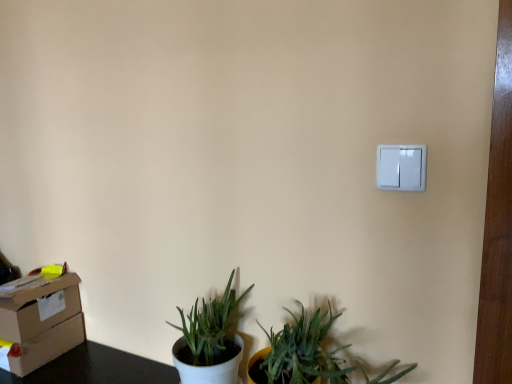
I want to click on white matte pot at lower left, so (210, 340).

Based on their sizes in the image, would you say matte brown cardboard box at lower left is bigger or smaller than white plastic light switch at upper right?

In the image, matte brown cardboard box at lower left appears to be larger than white plastic light switch at upper right.

Image resolution: width=512 pixels, height=384 pixels. I want to click on cardboard box beneath the white plastic light switch at upper right (from a real-world perspective), so click(39, 319).

How different are the orientations of matte brown cardboard box at lower left and white plastic light switch at upper right in degrees?

matte brown cardboard box at lower left and white plastic light switch at upper right are facing 4.34 degrees away from each other.

Is matte brown cardboard box at lower left aimed at white plastic light switch at upper right?

No.

Consider the image. Is white plastic light switch at upper right aimed at matte brown cardboard box at lower left?

No, white plastic light switch at upper right is not aimed at matte brown cardboard box at lower left.

Which object is more forward, white plastic light switch at upper right or matte brown cardboard box at lower left?

white plastic light switch at upper right is in front.

Considering the relative positions of white plastic light switch at upper right and matte brown cardboard box at lower left in the image provided, is white plastic light switch at upper right to the left or to the right of matte brown cardboard box at lower left?

Based on their positions, white plastic light switch at upper right is located to the right of matte brown cardboard box at lower left.

The image size is (512, 384). What are the coordinates of `light switch on the right of matte brown cardboard box at lower left` in the screenshot? It's located at (401, 167).

From the image's perspective, between white matte pot at lower left and white plastic light switch at upper right, who is located below?

white matte pot at lower left.

Identify the location of houseplant lying behind the white plastic light switch at upper right. This screenshot has width=512, height=384. (210, 340).

Would you consider white matte pot at lower left to be distant from white plastic light switch at upper right?

A: No, white matte pot at lower left is not far from white plastic light switch at upper right.

Would you say white matte pot at lower left is outside white plastic light switch at upper right?

That's correct, white matte pot at lower left is outside of white plastic light switch at upper right.

From a real-world perspective, is white matte pot at lower left positioned above or below matte brown cardboard box at lower left?

white matte pot at lower left is above matte brown cardboard box at lower left.

Would you consider white matte pot at lower left to be distant from matte brown cardboard box at lower left?

white matte pot at lower left is near matte brown cardboard box at lower left, not far away.

Between white matte pot at lower left and matte brown cardboard box at lower left, which one has smaller size?

white matte pot at lower left.

Consider the image. From the image's perspective, is white matte pot at lower left below matte brown cardboard box at lower left?

Actually, white matte pot at lower left appears above matte brown cardboard box at lower left in the image.

Who is taller, matte brown cardboard box at lower left or white matte pot at lower left?

With more height is white matte pot at lower left.

Is matte brown cardboard box at lower left smaller than white matte pot at lower left?

Incorrect, matte brown cardboard box at lower left is not smaller in size than white matte pot at lower left.

Where is `cardboard box on the left of white matte pot at lower left`? This screenshot has width=512, height=384. cardboard box on the left of white matte pot at lower left is located at coordinates (39, 319).

Does matte brown cardboard box at lower left turn towards white matte pot at lower left?

No, matte brown cardboard box at lower left is not facing towards white matte pot at lower left.

From the image's perspective, is white plastic light switch at upper right located above or below white matte pot at lower left?

Clearly, from the image's perspective, white plastic light switch at upper right is above white matte pot at lower left.

Is white plastic light switch at upper right outside of white matte pot at lower left?

Yes, white plastic light switch at upper right is outside of white matte pot at lower left.

From a real-world perspective, which is physically above, white plastic light switch at upper right or white matte pot at lower left?

white plastic light switch at upper right, from a real-world perspective.

Considering the sizes of objects white plastic light switch at upper right and white matte pot at lower left in the image provided, who is taller, white plastic light switch at upper right or white matte pot at lower left?

white matte pot at lower left.

Find the location of a particular element. This screenshot has width=512, height=384. light switch that appears above the matte brown cardboard box at lower left (from a real-world perspective) is located at coordinates (401, 167).

Identify the location of cardboard box below the white plastic light switch at upper right (from the image's perspective). The image size is (512, 384). coord(39,319).

From the image, which object appears to be nearer to white plastic light switch at upper right, matte brown cardboard box at lower left or white matte pot at lower left?

The object closer to white plastic light switch at upper right is white matte pot at lower left.

Estimate the real-world distances between objects in this image. Which object is closer to matte brown cardboard box at lower left, white plastic light switch at upper right or white matte pot at lower left?

Among the two, white matte pot at lower left is located nearer to matte brown cardboard box at lower left.

When comparing their distances from white matte pot at lower left, does matte brown cardboard box at lower left or white plastic light switch at upper right seem closer?

matte brown cardboard box at lower left is closer to white matte pot at lower left.

When comparing their distances from white plastic light switch at upper right, does white matte pot at lower left or matte brown cardboard box at lower left seem closer?

white matte pot at lower left is positioned closer to the anchor white plastic light switch at upper right.

When comparing their distances from matte brown cardboard box at lower left, does white matte pot at lower left or white plastic light switch at upper right seem further?

The object further to matte brown cardboard box at lower left is white plastic light switch at upper right.

Considering their positions, is white plastic light switch at upper right positioned further to white matte pot at lower left than matte brown cardboard box at lower left?

white plastic light switch at upper right is positioned further to the anchor white matte pot at lower left.

This screenshot has height=384, width=512. In order to click on houseplant located between matte brown cardboard box at lower left and white plastic light switch at upper right in the left-right direction in this screenshot , I will do `click(210, 340)`.